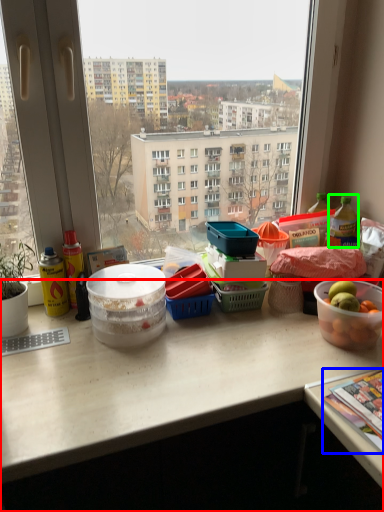
Question: Estimate the real-world distances between objects in this image. Which object is farther from desk (highlighted by a red box), magazine (highlighted by a blue box) or bottle (highlighted by a green box)?

Choices:
 (A) magazine
 (B) bottle

Answer: (B)